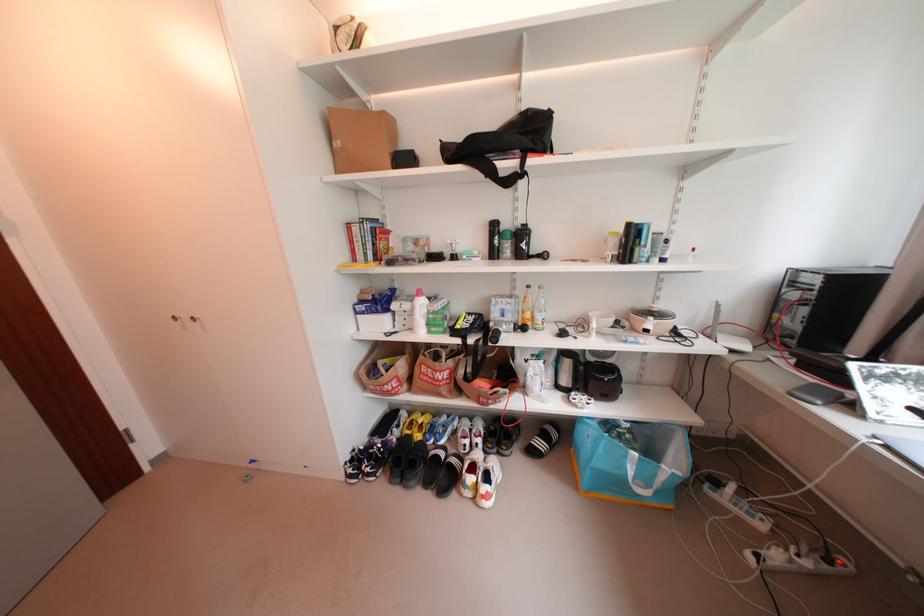
What do you see at coordinates (579, 400) in the screenshot? Image resolution: width=924 pixels, height=616 pixels. I see `a white soccer ball` at bounding box center [579, 400].